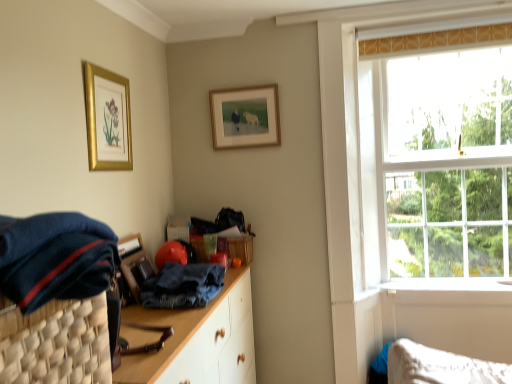
Question: Looking at the image, does gold metallic picture frame at upper left, which is counted as the second picture frame, starting from the back, seem bigger or smaller compared to dark blue woven basket at left?

Choices:
 (A) small
 (B) big

Answer: (A)

Question: From a real-world perspective, is gold metallic picture frame at upper left, the second picture frame positioned from the right, above or below dark blue woven basket at left?

Choices:
 (A) above
 (B) below

Answer: (A)

Question: Estimate the real-world distances between objects in this image. Which object is closer to the gold-framed picture at upper center, arranged as the 1th picture frame when viewed from the right?

Choices:
 (A) dark blue woven basket at left
 (B) gold metallic picture frame at upper left, the first picture frame viewed from the front
 (C) dark blue fabric at left, which is counted as the 2th clothing, starting from the bottom
 (D) clear glass window at upper right
 (E) denim at center, which is the 1th clothing in bottom-to-top order

Answer: (B)

Question: Considering the real-world distances, which object is farthest from the gold metallic picture frame at upper left, which is counted as the second picture frame, starting from the back?

Choices:
 (A) gold-framed picture at upper center, arranged as the 1th picture frame when viewed from the right
 (B) denim at center, which is the 1th clothing in bottom-to-top order
 (C) dark blue woven basket at left
 (D) dark blue fabric at left, the 2th clothing in the back-to-front sequence
 (E) clear glass window at upper right

Answer: (E)